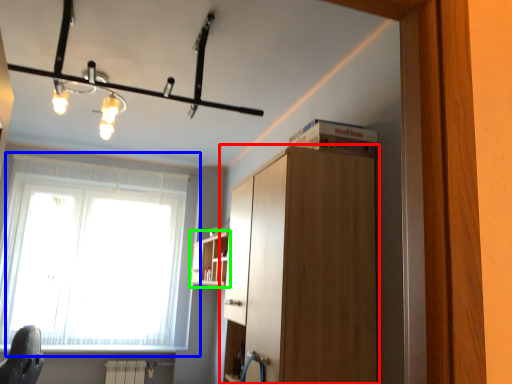
Question: Estimate the real-world distances between objects in this image. Which object is closer to cabinetry (highlighted by a red box), window (highlighted by a blue box) or shelf (highlighted by a green box)?

Choices:
 (A) window
 (B) shelf

Answer: (B)